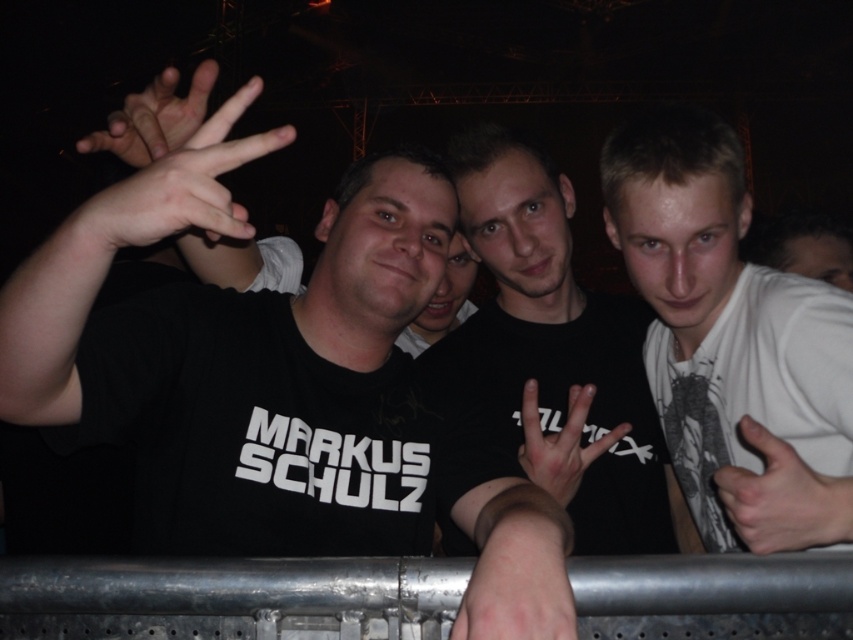
You are a photographer at the event and need to capture a clear shot of both the white matte shirt at right and the matte black hand at upper left. Which object should you focus on first to ensure both are in focus?

You should focus on the white matte shirt at right first because it is closer to you than the matte black hand at upper left, so focusing on it will ensure the matte black hand at upper left is also in focus.

You are a photographer at the event and want to ensure that both the white matte hand at center and the matte black hand at upper left are clearly visible in your photo. Given their sizes, which hand might you need to adjust your focus settings for to ensure clarity?

The white matte hand at center is not as tall as the matte black hand at upper left, so you may need to adjust focus settings for the smaller white matte hand at center to ensure clarity.